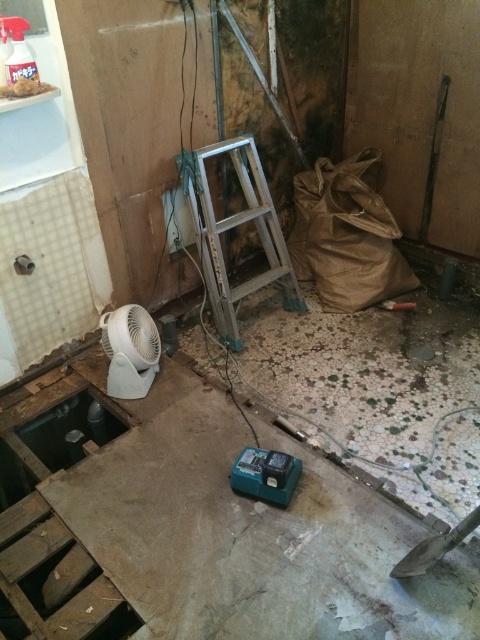
You are a worker in the room and need to reach a high spot on the wall to fix something. Which tool should you use, the silver metallic ladder at center or the metallic silver shovel at lower right?

The silver metallic ladder at center is located above the metallic silver shovel at lower right, so you should use the silver metallic ladder at center to reach the high spot on the wall.

Consider the image. You are a contractor in the room and need to reach the green plastic power tool at center and the metallic silver shovel at lower right. Which object is closer to you?

The green plastic power tool at center is positioned over the metallic silver shovel at lower right, so the green plastic power tool at center is closer to you.

You are a contractor working in the room and need to reach the green plastic power tool at center. You are currently standing at the point with coordinates 0.742, 0.554. Can you tell me the direction you should move to reach it?

The green plastic power tool at center is located at point (x=265, y=474), so you are already at the same coordinates as the green plastic power tool at center. You don